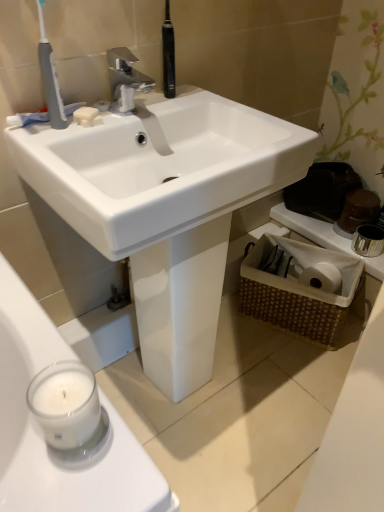
In order to click on vacant region to the left of white matte soap at upper left in this screenshot , I will do `click(49, 120)`.